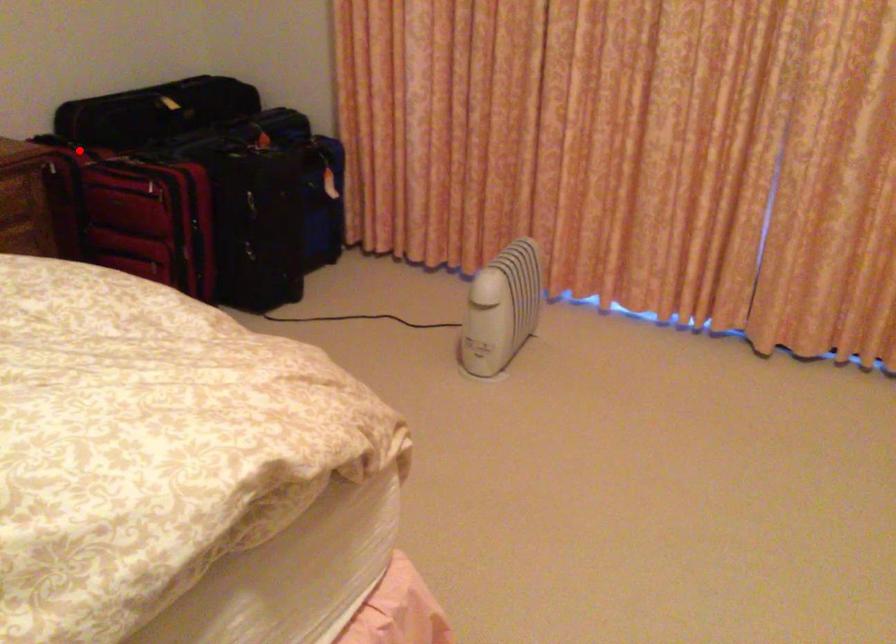
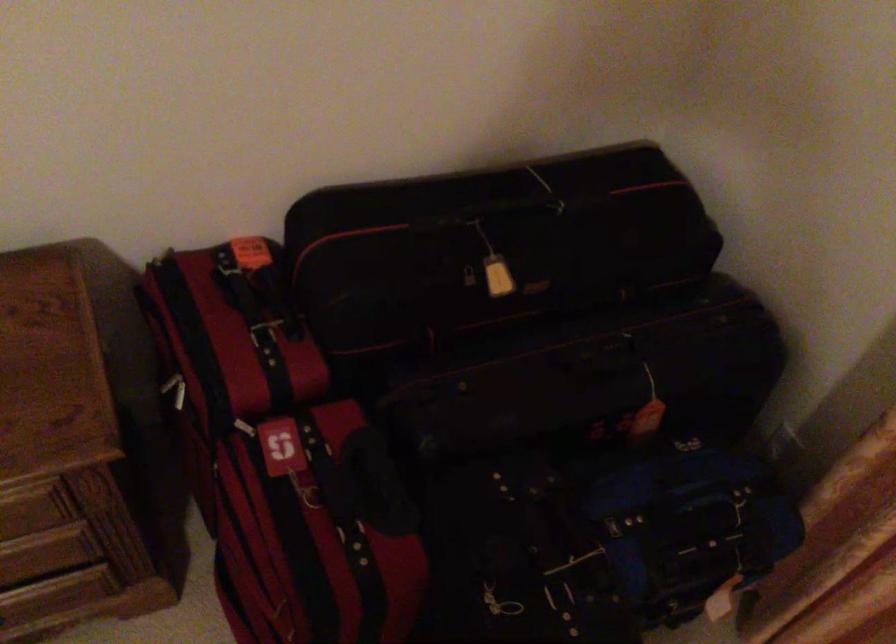
Question: I am providing you with two images of the same scene from different viewpoints. Image1 has a red point marked. In image2, the corresponding 3D location appears at what relative position? Reply with the corresponding letter.

Choices:
 (A) Closer
 (B) Farther

Answer: (A)